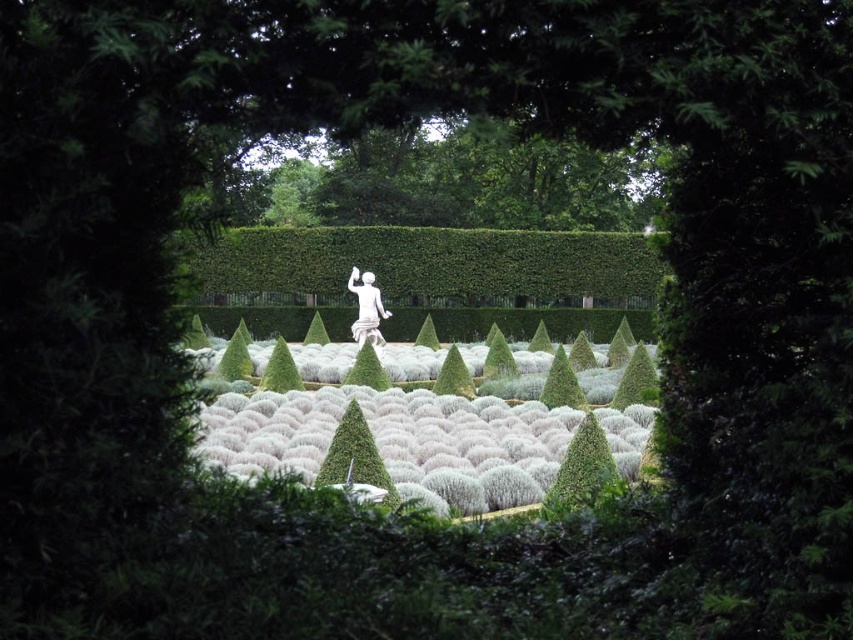
In the scene shown: You are a landscape architect planning to install a new sprinkler system. The sprinkler has a maximum range of 17 meters. If you position it at the green textured bush at center, will it reach the white marble statue at center?

The green textured bush at center is 17.15 meters away from the white marble statue at center. Since the sprinkler has a maximum range of 17 meters, it cannot reach the statue. The distance is 0.15 meters beyond the sprinkler system capacity.

From the picture: You are a landscape architect designing a new garden. You need to place a new fountain exactly between the green leafy hedge at center and the white marble statue at center. Which direction should the fountain be placed relative to the statue?

The green leafy hedge at center is positioned on the right side of the white marble statue at center, so the fountain should be placed to the left of the white marble statue at center to be exactly between them.

You are a landscape architect designing a new garden. You want to place a decorative fountain between the green leafy hedge at center and the white marble statue at center. Based on their widths, which object should the fountain be closer to?

The green leafy hedge at center is wider than the white marble statue at center. Therefore, the fountain should be placed closer to the white marble statue at center to maintain balance in the garden design.